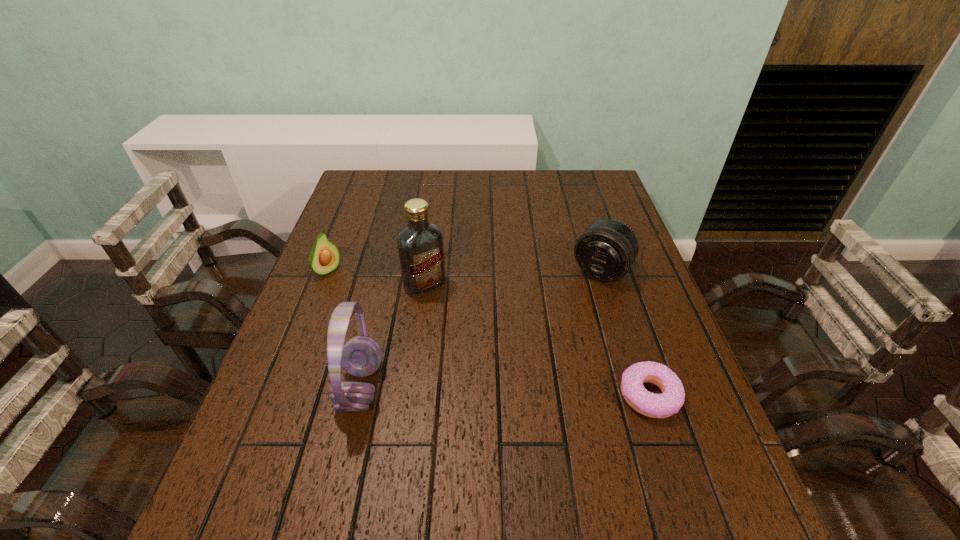
You are a GUI agent. You are given a task and a screenshot of the screen. Output one action in this format:
    pyautogui.click(x=<x>, y=<y>)
    Task: Click on the free space on the desktop that is between the second object from left to right and the doughnut and is positioned on the front-facing side of the telephoto lens
    The height and width of the screenshot is (540, 960).
    Given the screenshot: What is the action you would take?
    pyautogui.click(x=518, y=392)

You are a GUI agent. You are given a task and a screenshot of the screen. Output one action in this format:
    pyautogui.click(x=<x>, y=<y>)
    Task: Click on the vacant space on the desktop that is between the headset and the doughnut and is positioned on the cut side of the avocado
    The height and width of the screenshot is (540, 960).
    Given the screenshot: What is the action you would take?
    pyautogui.click(x=482, y=390)

At what (x,y) coordinates should I click in order to perform the action: click on vacant spot on the desktop that is between the headset and the doughnut and is positioned on the front-facing side of the vodka. Please return your answer as a coordinate pair (x, y). Looking at the image, I should click on (502, 391).